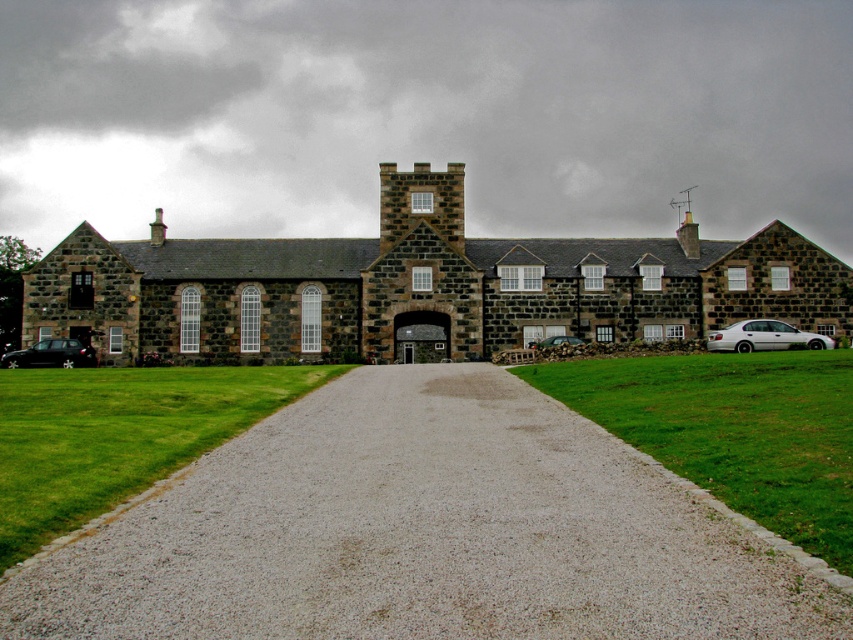
You are standing at the main entrance of the historic stone building and want to park your shiny black car at lower left in the closest available parking spot. The parking spots are marked at coordinates ranging from 0.0 to 1.0 in both x and y directions. Based on its current position at point 0.555, 0.060, can you determine if this spot is within the designated parking area?

The shiny black car at lower left is located at point [50,355]. Since parking spots are marked within the 0.0 to 1.0 coordinate range, the car is within the designated parking area as its coordinates fall within those bounds.

In the scene shown: You are standing 20 feet away from the historic stone building. A point labeled point (x=663, y=540) is marked on the building. Is this point closer to you or farther than your current position?

The distance of point (x=663, y=540) from viewer is 22.29 feet, so the point is farther away than your current position which is 20 feet away.